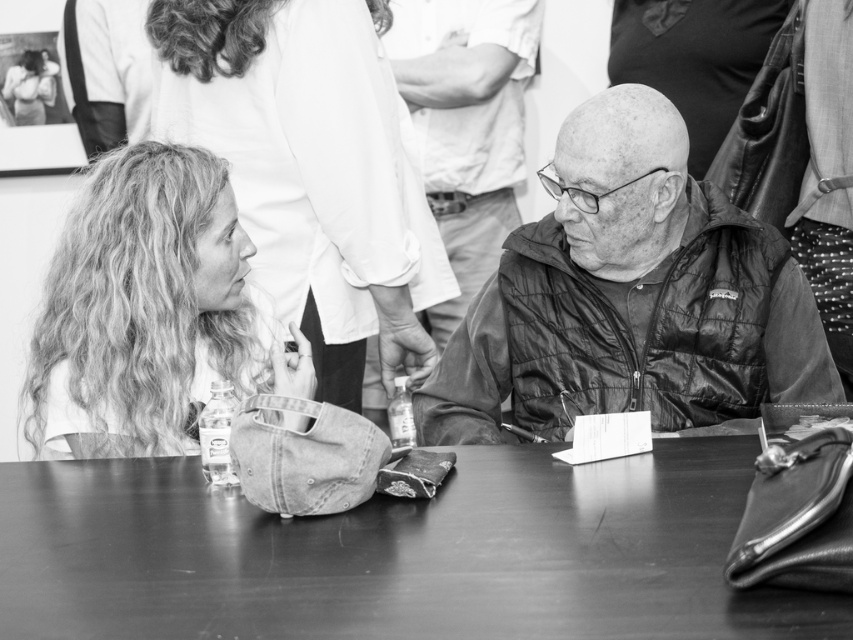
Question: Is the position of quilted black jacket at center more distant than that of curly hair at left?

Choices:
 (A) no
 (B) yes

Answer: (B)

Question: Which object is positioned closest to the smooth wood table at center?

Choices:
 (A) curly hair at left
 (B) leather jacket at center

Answer: (A)

Question: Which point is farther to the camera?

Choices:
 (A) (438, 595)
 (B) (138, 248)
 (C) (688, 240)
 (D) (444, 216)

Answer: (D)

Question: Is smooth wood table at center thinner than leather jacket at center?

Choices:
 (A) yes
 (B) no

Answer: (B)

Question: Can you confirm if quilted black jacket at center is positioned to the left of curly hair at left?

Choices:
 (A) no
 (B) yes

Answer: (A)

Question: Which point is farther to the camera?

Choices:
 (A) curly hair at left
 (B) leather jacket at center
 (C) quilted black jacket at center
 (D) smooth wood table at center

Answer: (B)